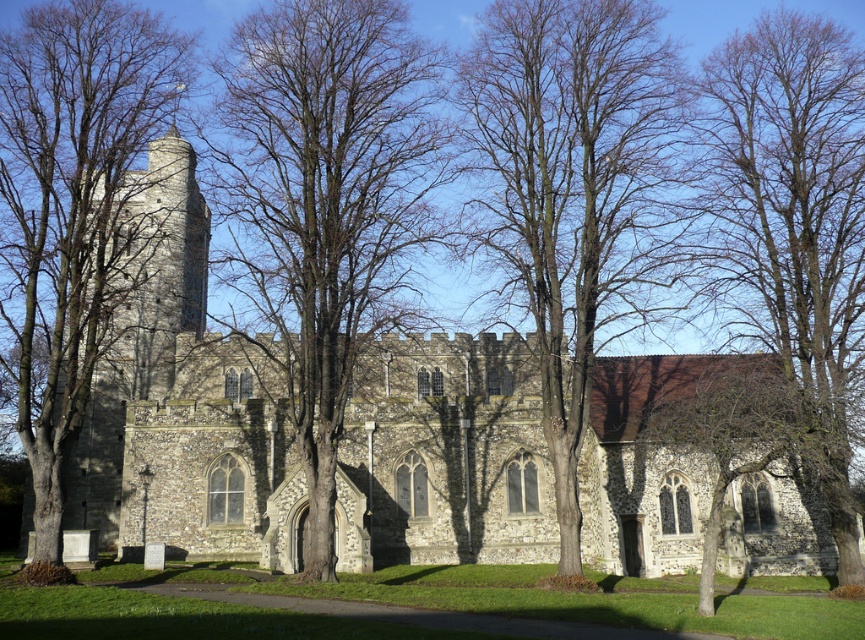
Question: Which object is the farthest from the stone church at center?

Choices:
 (A) bare branches at right
 (B) bare wood tree at left
 (C) bare wood tree at center

Answer: (A)

Question: Does bare branches at center have a lesser width compared to bare branches at right?

Choices:
 (A) yes
 (B) no

Answer: (B)

Question: Estimate the real-world distances between objects in this image. Which object is closer to the bare wood tree at left?

Choices:
 (A) stone church at center
 (B) bare wood tree at center
 (C) bare branches at right
 (D) bare branches at center

Answer: (D)

Question: Which object is positioned closest to the bare branches at center?

Choices:
 (A) bare branches at right
 (B) stone church at center

Answer: (B)

Question: Is bare branches at center above bare wood tree at center?

Choices:
 (A) no
 (B) yes

Answer: (B)

Question: Can you confirm if stone church at center is smaller than bare branches at center?

Choices:
 (A) yes
 (B) no

Answer: (B)